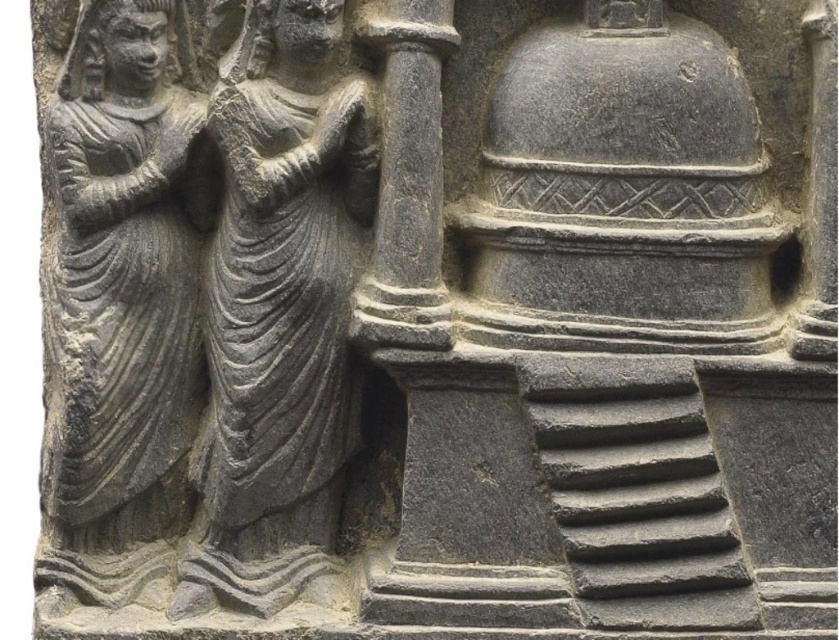
Question: Is gray stone statue at left wider than gray stone pillar at center?

Choices:
 (A) yes
 (B) no

Answer: (A)

Question: Among these objects, which one is farthest from the camera?

Choices:
 (A) gray stone pillar at center
 (B) gray stone statue at center

Answer: (B)

Question: Which point is farther to the camera?

Choices:
 (A) (207, 532)
 (B) (413, 195)
 (C) (81, 19)

Answer: (A)

Question: Which of the following is the closest to the observer?

Choices:
 (A) (394, 184)
 (B) (107, 433)
 (C) (279, 227)

Answer: (A)

Question: Does gray stone statue at left appear on the left side of gray stone pillar at center?

Choices:
 (A) yes
 (B) no

Answer: (A)

Question: Does gray stone statue at center lie in front of gray stone pillar at center?

Choices:
 (A) no
 (B) yes

Answer: (A)